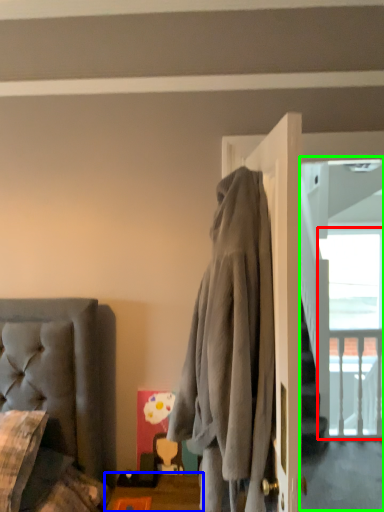
Question: Considering the real-world distances, which object is farthest from window (highlighted by a red box)? table (highlighted by a blue box) or screen door (highlighted by a green box)?

Choices:
 (A) table
 (B) screen door

Answer: (A)